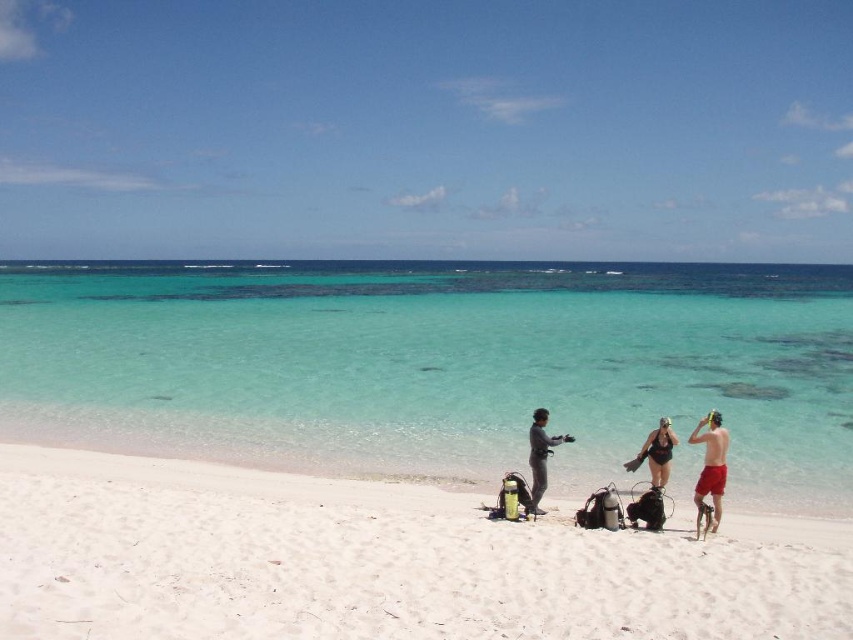
Question: Based on their relative distances, which object is nearer to the matte black wetsuit at center?

Choices:
 (A) white sandy beach at center
 (B) gray matte wetsuit at center
 (C) clear water at center

Answer: (B)

Question: Which object appears closest to the camera in this image?

Choices:
 (A) clear water at center
 (B) red fabric shorts at right
 (C) matte black wetsuit at center
 (D) gray matte wetsuit at center

Answer: (B)

Question: Is red fabric shorts at right wider than black matte swimsuit at center?

Choices:
 (A) yes
 (B) no

Answer: (A)

Question: Does white sandy beach at center lie behind gray matte wetsuit at center?

Choices:
 (A) no
 (B) yes

Answer: (A)

Question: Which of the following is the closest to the observer?

Choices:
 (A) (434, 506)
 (B) (799, 349)
 (C) (711, 524)

Answer: (C)

Question: Can you confirm if matte black wetsuit at center is thinner than gray matte wetsuit at center?

Choices:
 (A) no
 (B) yes

Answer: (B)